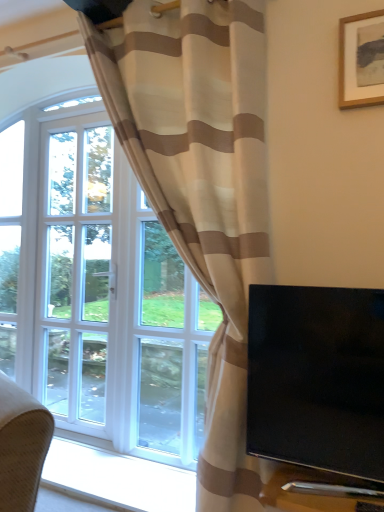
Question: Is black glossy tv at right completely or partially outside of white glass screen door at left?

Choices:
 (A) no
 (B) yes

Answer: (B)

Question: Is black glossy tv at right at the left side of white glass screen door at left?

Choices:
 (A) no
 (B) yes

Answer: (A)

Question: From the image's perspective, is black glossy tv at right under white glass screen door at left?

Choices:
 (A) no
 (B) yes

Answer: (B)

Question: Considering the relative positions of black glossy tv at right and white glass screen door at left in the image provided, is black glossy tv at right to the right of white glass screen door at left from the viewer's perspective?

Choices:
 (A) no
 (B) yes

Answer: (B)

Question: Is white glass screen door at left a part of black glossy tv at right?

Choices:
 (A) no
 (B) yes

Answer: (A)

Question: Considering the relative sizes of black glossy tv at right and white glass screen door at left in the image provided, is black glossy tv at right shorter than white glass screen door at left?

Choices:
 (A) yes
 (B) no

Answer: (A)

Question: Is wooden picture frame at upper right to the right of beige striped curtain at left from the viewer's perspective?

Choices:
 (A) yes
 (B) no

Answer: (A)

Question: Is wooden picture frame at upper right not inside beige striped curtain at left?

Choices:
 (A) no
 (B) yes

Answer: (B)

Question: Is the depth of wooden picture frame at upper right less than that of beige striped curtain at left?

Choices:
 (A) yes
 (B) no

Answer: (B)

Question: Can you confirm if wooden picture frame at upper right is smaller than beige striped curtain at left?

Choices:
 (A) yes
 (B) no

Answer: (A)

Question: From the image's perspective, does wooden picture frame at upper right appear lower than beige striped curtain at left?

Choices:
 (A) yes
 (B) no

Answer: (B)

Question: Is wooden picture frame at upper right bigger than beige striped curtain at left?

Choices:
 (A) yes
 (B) no

Answer: (B)

Question: Can you confirm if wooden picture frame at upper right is positioned to the right of white glass screen door at left?

Choices:
 (A) no
 (B) yes

Answer: (B)